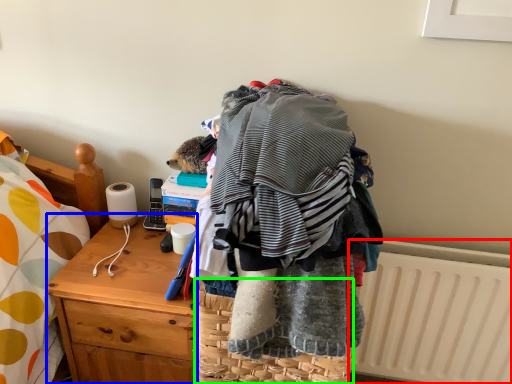
Question: Considering the real-world distances, which object is farthest from radiator (highlighted by a red box)? desk (highlighted by a blue box) or picnic basket (highlighted by a green box)?

Choices:
 (A) desk
 (B) picnic basket

Answer: (A)